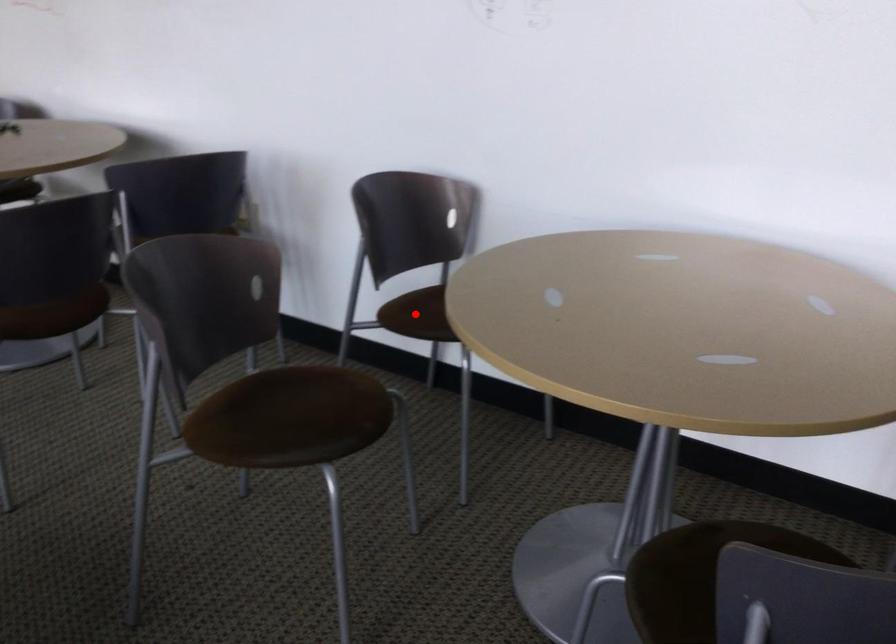
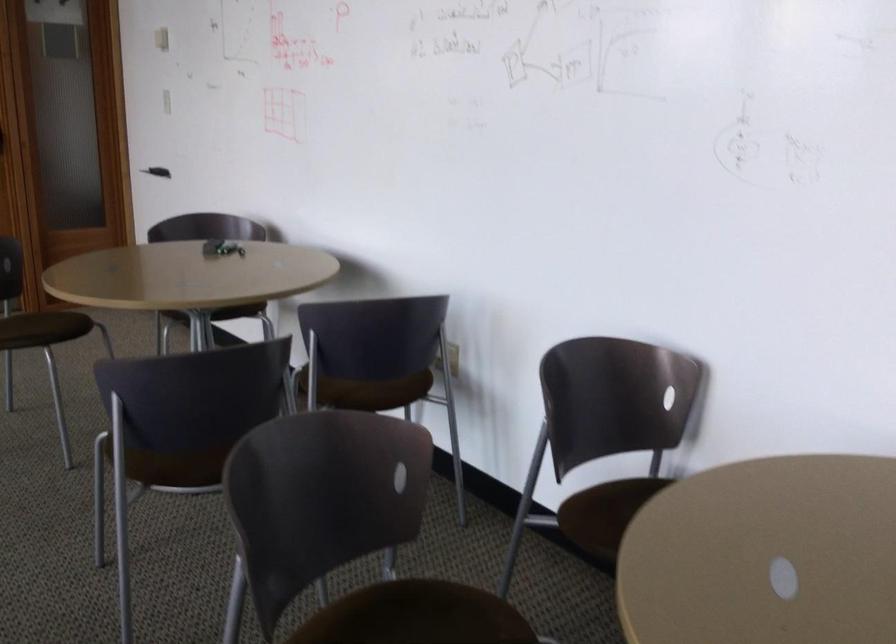
The point at the highlighted location is marked in the first image. Where is the corresponding point in the second image?

(595, 514)